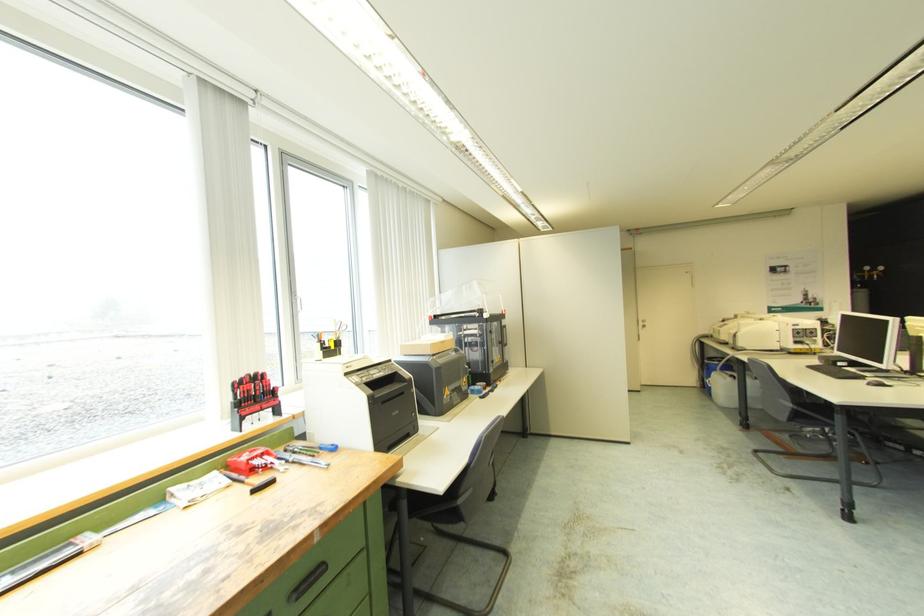
Image resolution: width=924 pixels, height=616 pixels. I want to click on silver door handle, so click(x=307, y=582).